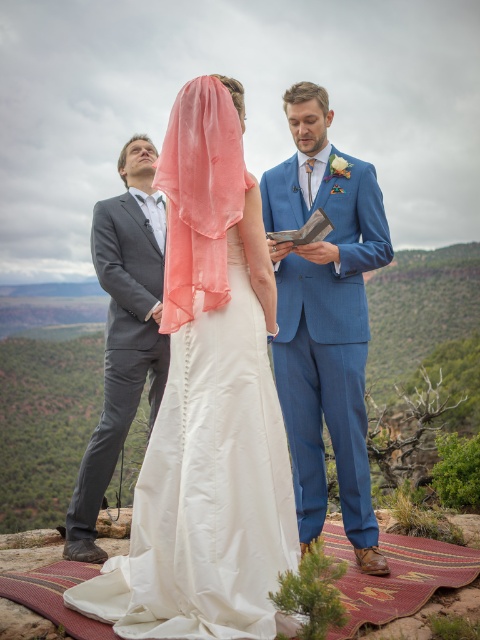
Which of these two, matte gray suit at left or coral sheer veil at center, stands taller?

matte gray suit at left

The height and width of the screenshot is (640, 480). I want to click on matte gray suit at left, so pyautogui.click(x=122, y=332).

Is blue wool suit at center thinner than coral sheer veil at center?

No, blue wool suit at center is not thinner than coral sheer veil at center.

Which is behind, point (324, 451) or point (179, 266)?

Point (324, 451)

Locate an element on the screen. The image size is (480, 640). blue wool suit at center is located at coordinates (324, 317).

Does blue wool suit at center appear under matte gray suit at left?

Incorrect, blue wool suit at center is not positioned below matte gray suit at left.

Which is more to the right, blue wool suit at center or matte gray suit at left?

blue wool suit at center

From the picture: Who is more forward, [291,396] or [97,548]?

Positioned in front is point [291,396].

You are a GUI agent. You are given a task and a screenshot of the screen. Output one action in this format:
    pyautogui.click(x=<x>, y=<y>)
    Task: Click on the blue wool suit at center
    This screenshot has height=640, width=480.
    Given the screenshot: What is the action you would take?
    pos(324,317)